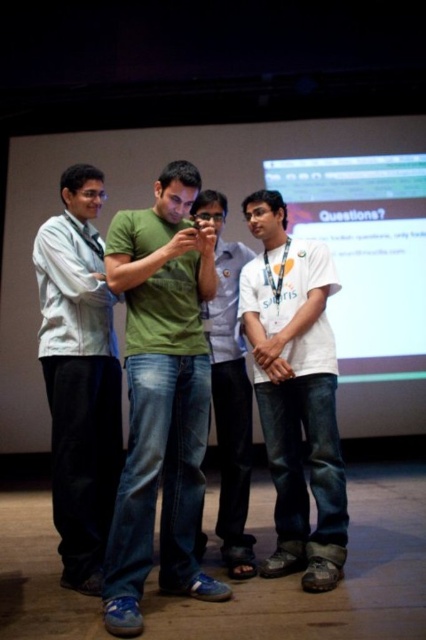
Is white cotton shirt at center to the right of green denim jeans at center from the viewer's perspective?

Indeed, white cotton shirt at center is positioned on the right side of green denim jeans at center.

Is white cotton shirt at center thinner than green denim jeans at center?

In fact, white cotton shirt at center might be wider than green denim jeans at center.

Who is more distant from viewer, (321, 264) or (244, 413)?

The point (244, 413) is behind.

You are a GUI agent. You are given a task and a screenshot of the screen. Output one action in this format:
    pyautogui.click(x=<x>, y=<y>)
    Task: Click on the white cotton shirt at center
    This screenshot has height=640, width=426.
    Given the screenshot: What is the action you would take?
    pyautogui.click(x=296, y=392)

Does white matte projection screen at upper center have a lesser height compared to green denim jeans at center?

Indeed, white matte projection screen at upper center has a lesser height compared to green denim jeans at center.

From the picture: Who is positioned more to the left, white matte projection screen at upper center or green denim jeans at center?

Positioned to the left is white matte projection screen at upper center.

Who is more distant from viewer, [55,202] or [238,278]?

The point [55,202] is behind.

Where is `white matte projection screen at upper center`? Image resolution: width=426 pixels, height=640 pixels. white matte projection screen at upper center is located at coordinates (143, 205).

Does green matte t-shirt at center appear on the left side of white cotton shirt at center?

Yes, green matte t-shirt at center is to the left of white cotton shirt at center.

The height and width of the screenshot is (640, 426). In order to click on green matte t-shirt at center in this screenshot , I will do `click(161, 396)`.

Image resolution: width=426 pixels, height=640 pixels. In order to click on green matte t-shirt at center in this screenshot , I will do `click(161, 396)`.